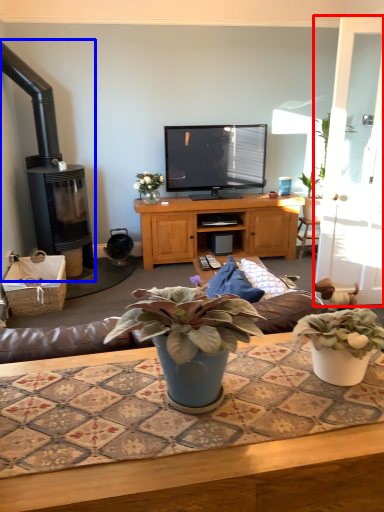
Question: Which object appears farthest to the camera in this image, glass door (highlighted by a red box) or fireplace (highlighted by a blue box)?

Choices:
 (A) glass door
 (B) fireplace

Answer: (B)